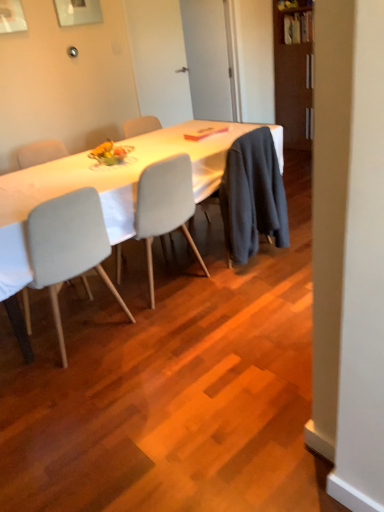
The image size is (384, 512). Identify the location of free space in front of light gray fabric chair at center, which ranks as the 2th chair in left-to-right order. (181, 326).